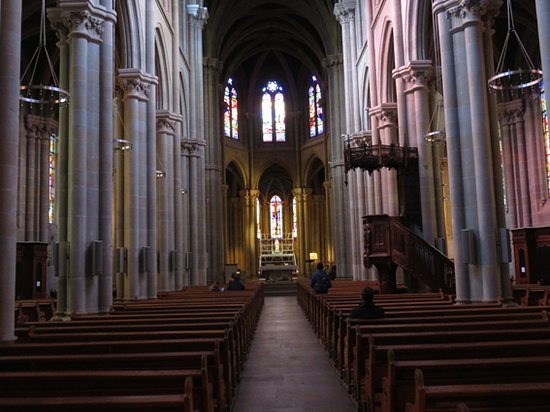
Identify the location of stained glass windows. (274, 221), (258, 220), (295, 217), (231, 111), (275, 108), (315, 111), (50, 185), (500, 187), (546, 136).